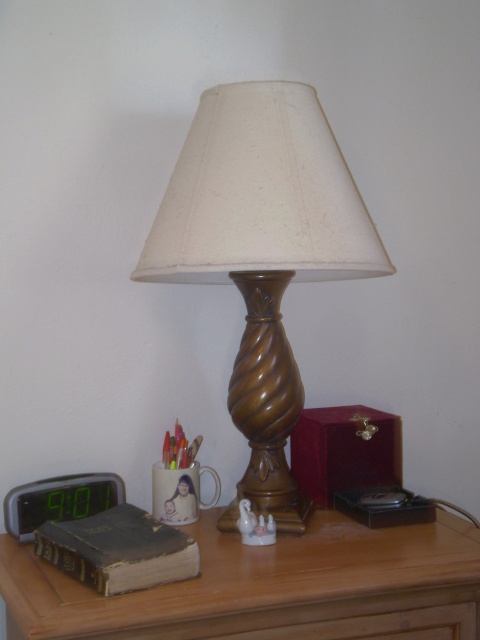
You are trying to place a new item on the brown wooden table at center. The item is as wide as the green digital display at left. Will it fit on the table?

The brown wooden table at center might be wider than the green digital display at left, so there is a possibility that the item will fit, but it depends on the exact dimensions.

You are organizing items on the brown wooden table at center and need to place a new item between the wooden table lamp at center and the edge of the table. Where should you place it?

The wooden table lamp at center is on the right side of the brown wooden table at center, so place the new item between the wooden table lamp at center and the right edge of the brown wooden table at center.

You are standing in front of the bedside table and want to place a small object on the table. If you place it at point A, which is at coordinates point (351, 632), will it be closer to the edge of the table compared to placing it at point B, point (92, 493)?

Point (351, 632) is in front of point (92, 493), so placing the object at point A would be closer to the edge of the table compared to point B.